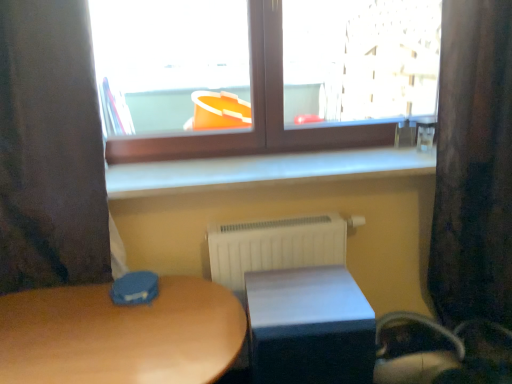
I want to click on free location to the right of dark fabric curtain at left, placed as the 1th curtain when sorted from left to right, so click(x=165, y=313).